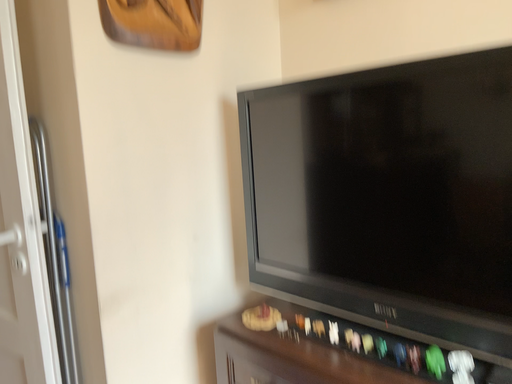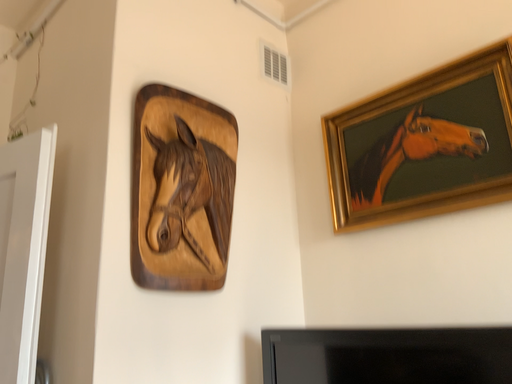
Question: Which way did the camera rotate in the video?

Choices:
 (A) rotated downward
 (B) rotated upward

Answer: (B)